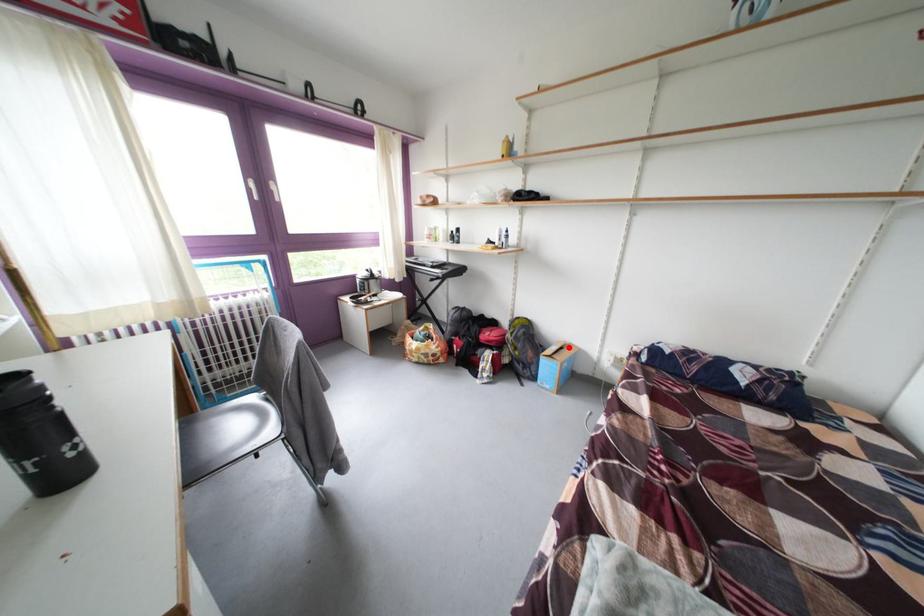
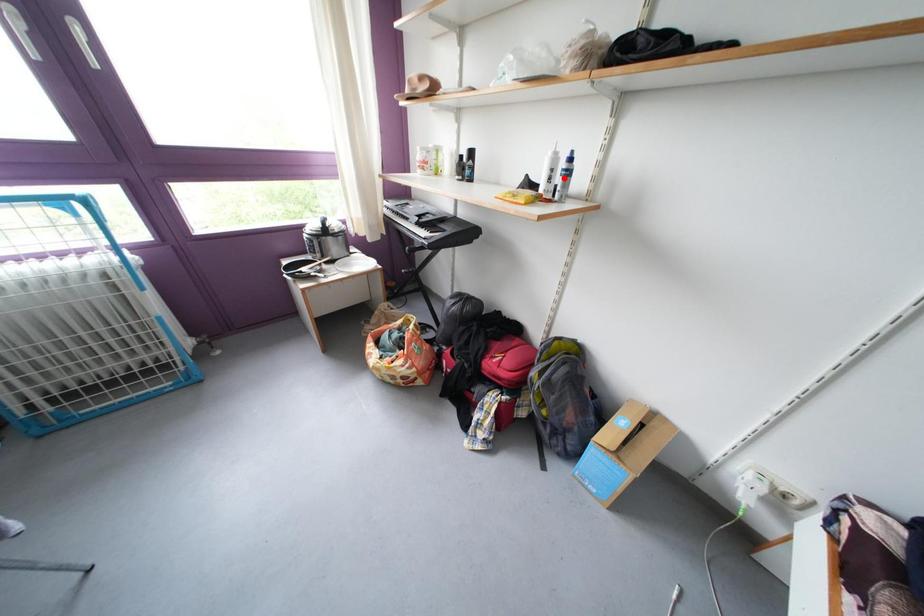
I am providing you with two images of the same scene from different viewpoints. A red point is marked on the first image and another point is marked on the second image. Do the highlighted points in image1 and image2 indicate the same real-world spot?

No